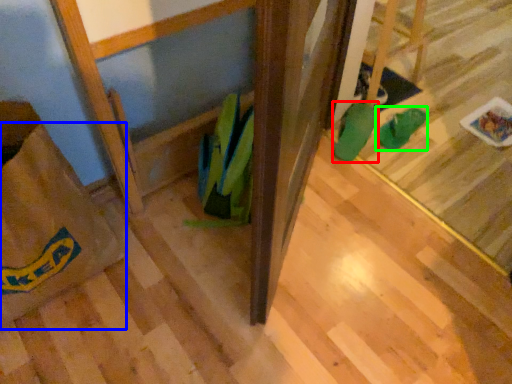
Question: Which object is positioned farthest from footwear (highlighted by a red box)? Select from grocery bag (highlighted by a blue box) and footwear (highlighted by a green box).

Choices:
 (A) grocery bag
 (B) footwear

Answer: (A)